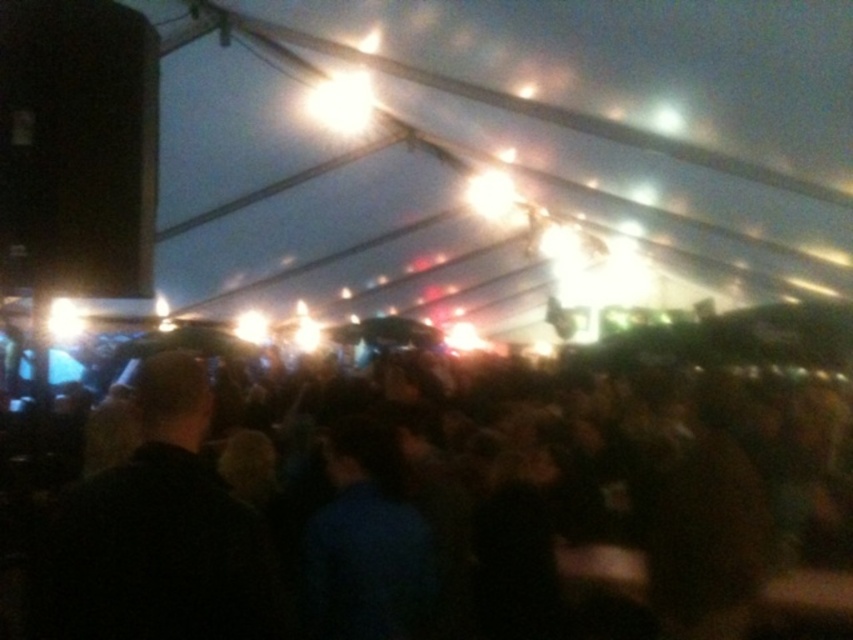
You are a photographer at the event and want to capture a clear shot of the stage. You notice a point at coordinates (462,508) in your viewfinder. What object is located at that point?

The point at coordinates (462,508) corresponds to the black matte crowd at center.

You are a photographer at the event and want to capture a clear photo of the dark hair at center without the black matte crowd at center blocking it. What should you do?

To capture a clear photo of the dark hair at center without the black matte crowd at center blocking it, you should move your position to a spot where the dark hair at center is in front of the black matte crowd at center.

You are standing at the entrance of the tent and want to reach the stage. The black matte crowd at center is blocking your path. If you move to the right, will you be able to bypass the crowd and reach the stage?

The black matte crowd at center is located at point (462,508). Moving to the right would allow you to bypass the crowd and reach the stage since the crowd is centrally located, leaving space on the sides for navigation.